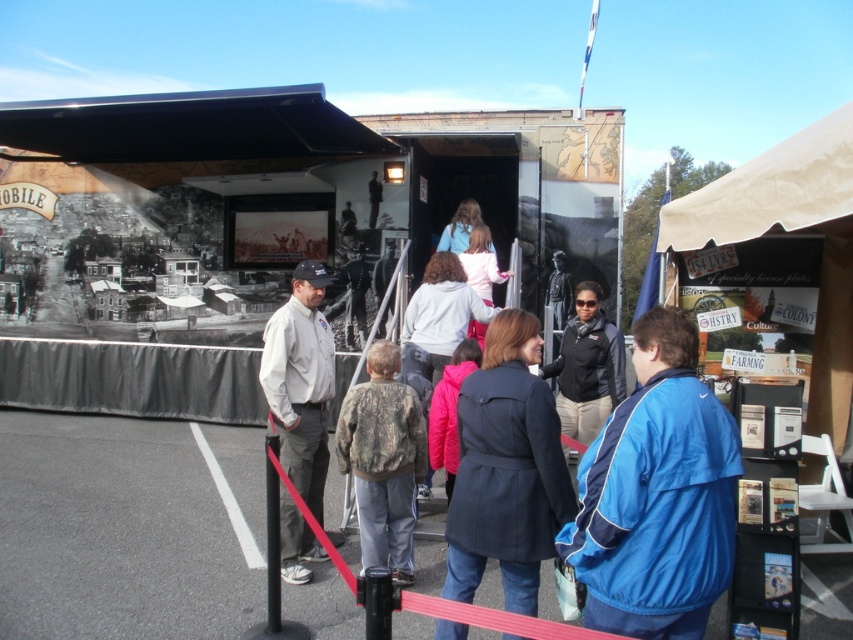
Question: Can you confirm if camouflage jacket at center is positioned above black fleece jacket at center?

Choices:
 (A) yes
 (B) no

Answer: (B)

Question: Which object is closer to the camera taking this photo?

Choices:
 (A) white painted line at center
 (B) dark blue coat at center
 (C) blue synthetic jacket at center
 (D) khaki cotton shirt at left

Answer: (C)

Question: Which object is positioned farthest from the camouflage jacket at center?

Choices:
 (A) black fleece jacket at center
 (B) dark blue coat at center
 (C) khaki cotton shirt at left
 (D) white painted line at center

Answer: (A)

Question: Which of the following is the closest to the observer?

Choices:
 (A) (817, 218)
 (B) (299, 438)

Answer: (A)

Question: Does dark blue coat at center have a smaller size compared to beige canvas canopy at upper right?

Choices:
 (A) yes
 (B) no

Answer: (A)

Question: Can you confirm if camouflage jacket at center is positioned to the right of white painted line at center?

Choices:
 (A) no
 (B) yes

Answer: (B)